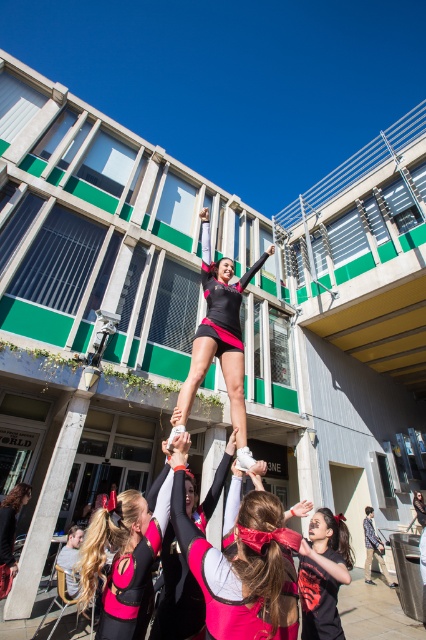
Between matte pink cheerleader at center and matte black leotard at center, which one appears on the left side from the viewer's perspective?

Positioned to the left is matte pink cheerleader at center.

How much distance is there between matte pink cheerleader at center and matte black leotard at center?

matte pink cheerleader at center and matte black leotard at center are 1.02 meters apart from each other.

Where is `matte pink cheerleader at center`? The height and width of the screenshot is (640, 426). matte pink cheerleader at center is located at coordinates (222, 573).

I want to click on matte pink cheerleader at center, so click(x=222, y=573).

Which is more to the right, matte pink uniform at center or matte black leotard at center?

Positioned to the right is matte black leotard at center.

Is point (97, 568) positioned before point (209, 292)?

Yes, it is in front of point (209, 292).

Find the location of a particular element. The width and height of the screenshot is (426, 640). matte pink uniform at center is located at coordinates (126, 557).

Which is above, matte pink uniform at center or matte black shirt at center?

matte pink uniform at center

Is point (146, 536) in front of point (344, 566)?

Yes, point (146, 536) is in front of point (344, 566).

Image resolution: width=426 pixels, height=640 pixels. I want to click on matte pink uniform at center, so click(126, 557).